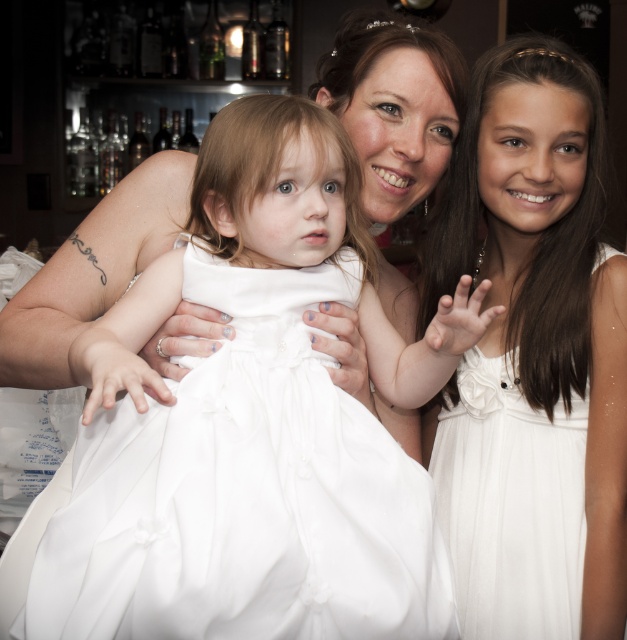
Question: Can you confirm if white satin dress at center is positioned to the right of white satin dress at right?

Choices:
 (A) no
 (B) yes

Answer: (A)

Question: Which point appears closest to the camera in this image?

Choices:
 (A) (460, 486)
 (B) (265, 312)

Answer: (B)

Question: Observing the image, what is the correct spatial positioning of white satin dress at center in reference to white satin dress at right?

Choices:
 (A) right
 (B) left

Answer: (B)

Question: Which object is farther from the camera taking this photo?

Choices:
 (A) white satin dress at center
 (B) white satin dress at right

Answer: (B)

Question: Which object is closer to the camera taking this photo?

Choices:
 (A) white satin dress at center
 (B) white satin dress at right

Answer: (A)

Question: Does white satin dress at center appear under white satin dress at right?

Choices:
 (A) yes
 (B) no

Answer: (A)